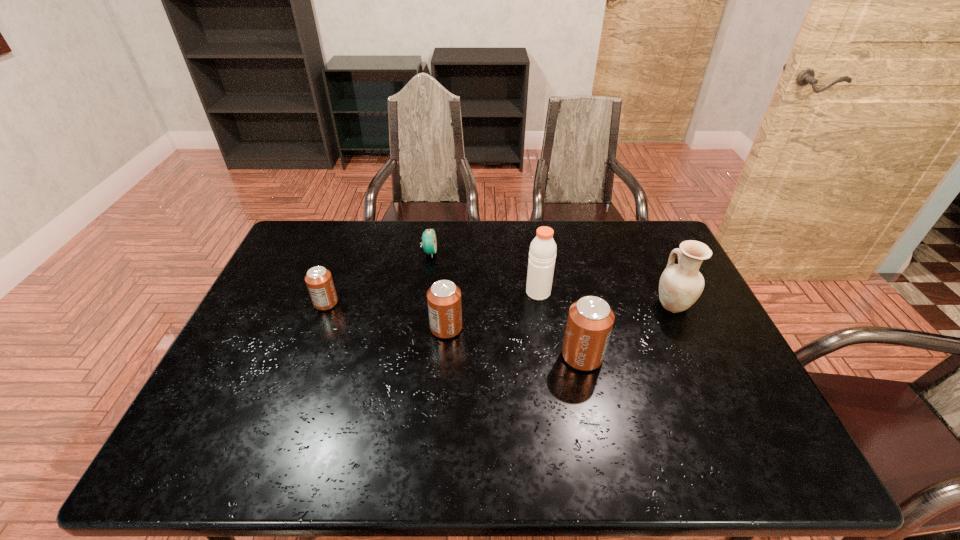
This screenshot has height=540, width=960. I want to click on vacant region at the left edge, so click(x=281, y=266).

The height and width of the screenshot is (540, 960). I want to click on vacant region at the right edge of the desktop, so click(x=732, y=353).

Identify the location of blank region between the rightmost can and the rightmost object. point(628,330).

The height and width of the screenshot is (540, 960). I want to click on unoccupied position between the rightmost object and the second can from right to left, so click(560, 316).

Find the location of a particular element. The width and height of the screenshot is (960, 540). free space between the shortest can and the pottery is located at coordinates (499, 303).

Where is `free space between the pottery and the leftmost can`? The image size is (960, 540). free space between the pottery and the leftmost can is located at coordinates [x=499, y=303].

I want to click on vacant area between the shaker and the shortest object, so click(x=484, y=272).

The height and width of the screenshot is (540, 960). I want to click on vacant space that is in between the tallest can and the shortest object, so click(x=506, y=304).

Locate an element on the screen. free space that is in between the nearest can and the second object from left to right is located at coordinates (506, 304).

Find the location of a particular element. The width and height of the screenshot is (960, 540). unoccupied area between the shaker and the rightmost object is located at coordinates (606, 298).